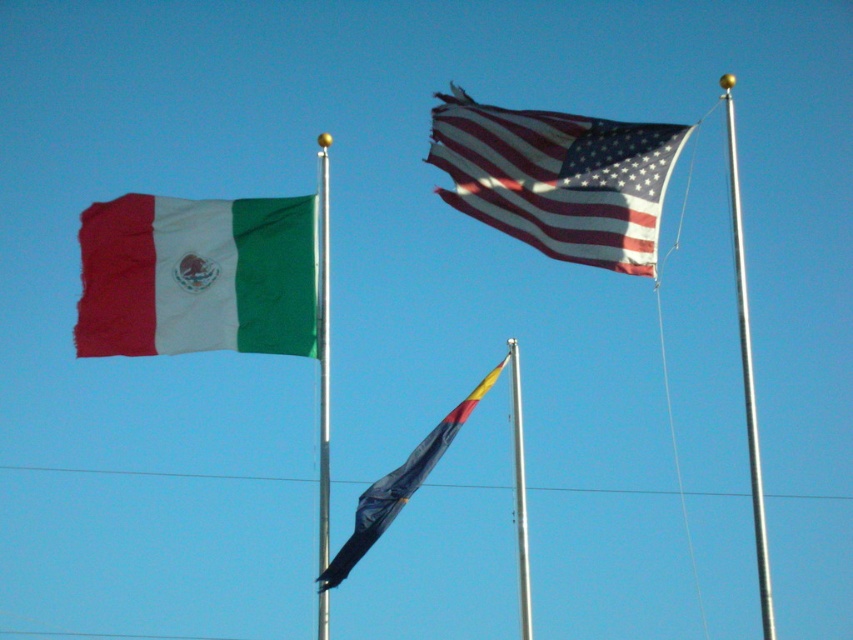
You are standing in front of three flags. There are two points marked on the image. The first point is at coordinates point (547, 221) and the second point is at point (321, 216). Which point is closer to you?

Point (547, 221) is in front of point (321, 216), so it is closer to you.

You are a photographer trying to capture the flags in the scene. The rippled fabric flag at upper center and the silver metallic pole at center are both in your view. Which one appears shorter in the photo?

The rippled fabric flag at upper center appears shorter than the silver metallic pole at center because it is not as tall.